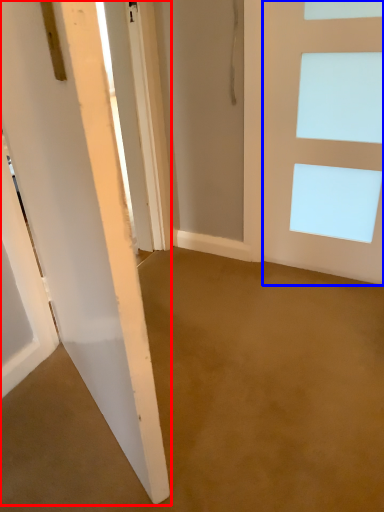
Question: Which object appears farthest to the camera in this image, door (highlighted by a red box) or door (highlighted by a blue box)?

Choices:
 (A) door
 (B) door

Answer: (B)